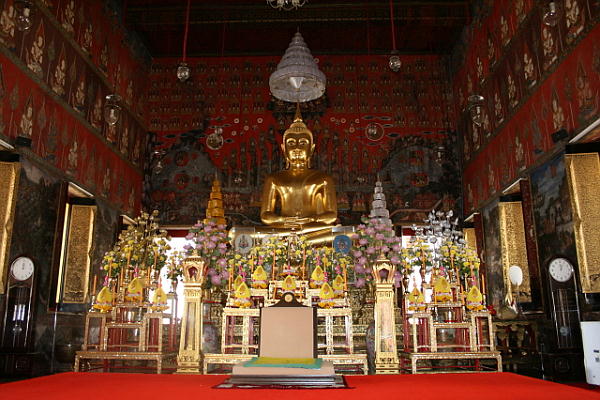
The image size is (600, 400). Identify the location of stand for plants and decor. (449, 325), (132, 324), (170, 296), (412, 316), (240, 314), (256, 294), (274, 280).